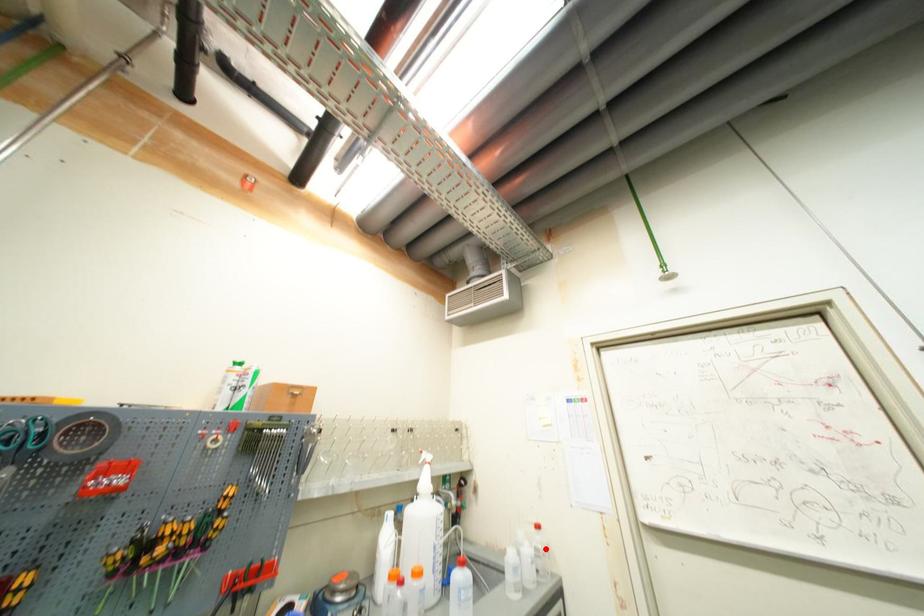
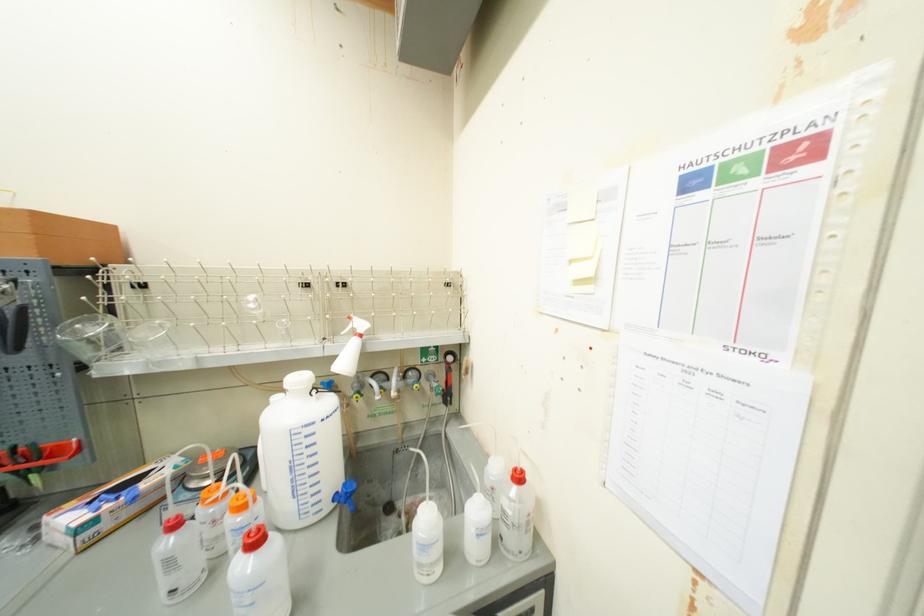
Question: I am providing you with two images of the same scene from different viewpoints. A red point is marked on the first image. Can you still see the location of the red point in image 2?

Choices:
 (A) Yes
 (B) No

Answer: (A)